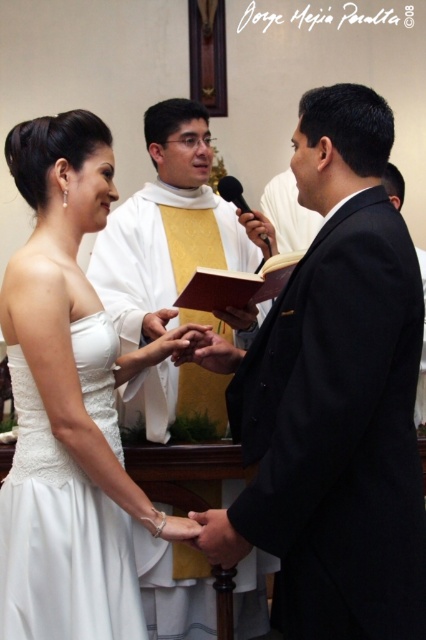
Can you confirm if black matte suit at center is positioned below matte black suit at center?

Yes.

Is black matte suit at center to the right of matte black suit at center from the viewer's perspective?

Yes, black matte suit at center is to the right of matte black suit at center.

Describe the element at coordinates (333, 397) in the screenshot. I see `black matte suit at center` at that location.

The width and height of the screenshot is (426, 640). What are the coordinates of `black matte suit at center` in the screenshot? It's located at (x=333, y=397).

Is black matte suit at center wider than silver metallic ring at lower center?

Yes.

Does black matte suit at center appear over silver metallic ring at lower center?

Yes, black matte suit at center is above silver metallic ring at lower center.

Image resolution: width=426 pixels, height=640 pixels. What do you see at coordinates (333, 397) in the screenshot?
I see `black matte suit at center` at bounding box center [333, 397].

Find the location of a particular element. The width and height of the screenshot is (426, 640). black matte suit at center is located at coordinates (333, 397).

Is matte black suit at center shorter than silver metallic ring at lower center?

Incorrect, matte black suit at center's height does not fall short of silver metallic ring at lower center's.

Between point (166, 208) and point (161, 520), which one is positioned behind?

The point (166, 208) is more distant.

What do you see at coordinates (170, 234) in the screenshot? I see `matte black suit at center` at bounding box center [170, 234].

The height and width of the screenshot is (640, 426). I want to click on matte black suit at center, so click(x=170, y=234).